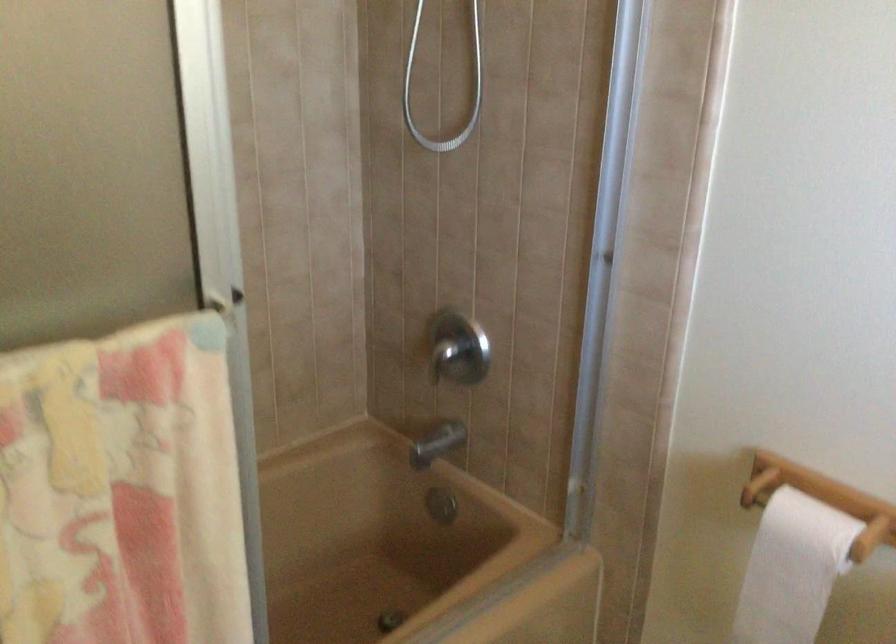
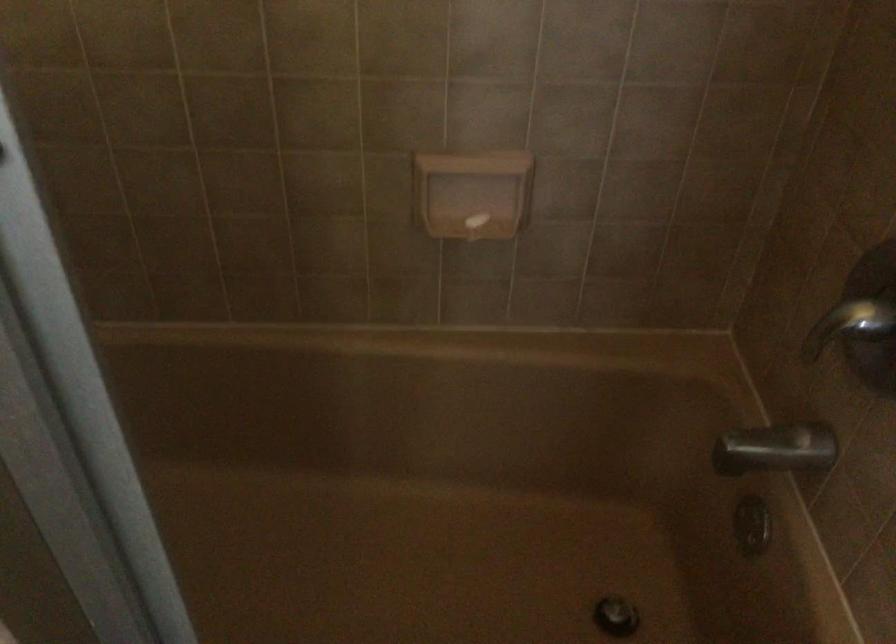
Based on the continuous images, in which direction is the camera rotating?

The camera rotated toward left-down.